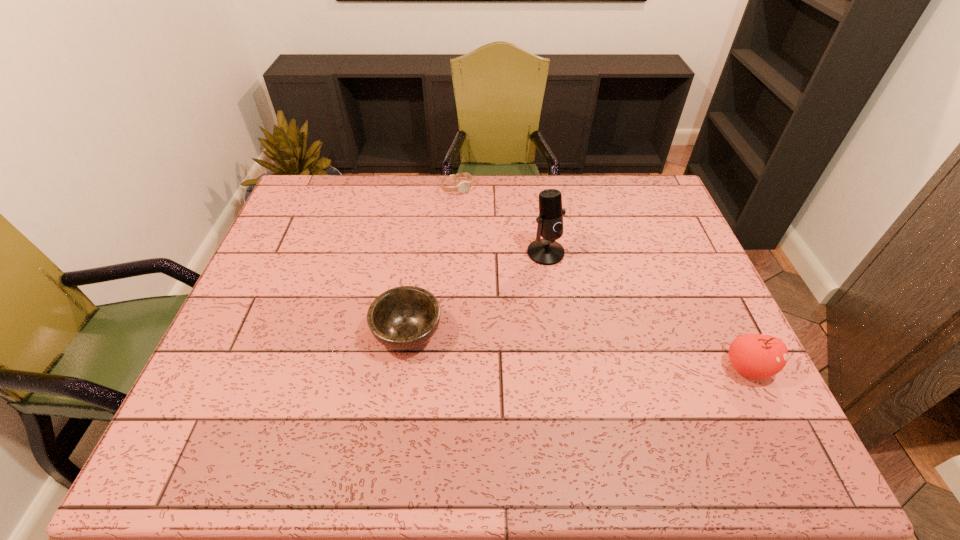
The width and height of the screenshot is (960, 540). What are the coordinates of `free space that is in between the watch and the second shortest object` in the screenshot? It's located at (432, 260).

The width and height of the screenshot is (960, 540). I want to click on free space between the farthest object and the third tallest object, so [x=432, y=260].

Locate an element on the screen. vacant space that is in between the second shortest object and the tallest object is located at coordinates (477, 293).

Locate an element on the screen. vacant space that is in between the tallest object and the apple is located at coordinates (646, 310).

This screenshot has height=540, width=960. In order to click on empty space between the second farthest object and the apple in this screenshot , I will do `click(646, 310)`.

In order to click on free space between the bowl and the third object from left to right in this screenshot , I will do `click(477, 293)`.

Point out which object is positioned as the third nearest to the farthest object. Please provide its 2D coordinates. Your answer should be formatted as a tuple, i.e. [(x, y)], where the tuple contains the x and y coordinates of a point satisfying the conditions above.

[(758, 356)]

I want to click on object identified as the third closest to the third tallest object, so click(x=758, y=356).

The width and height of the screenshot is (960, 540). I want to click on vacant space that satisfies the following two spatial constraints: 1. on the back side of the second shortest object; 2. on the right side of the second farthest object, so pyautogui.click(x=419, y=253).

Locate an element on the screen. free space that satisfies the following two spatial constraints: 1. on the back side of the farthest object; 2. on the right side of the bowl is located at coordinates (428, 188).